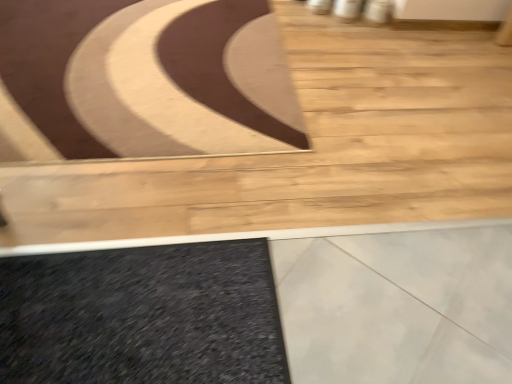
Find the location of a particular element. This screenshot has height=384, width=512. free point above granite stairs at center (from a real-world perspective) is located at coordinates (234, 135).